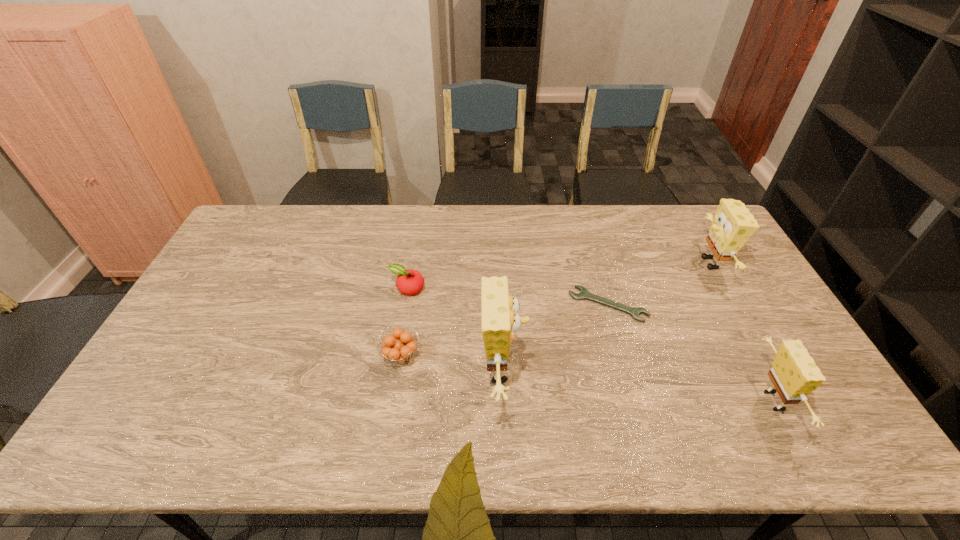
Please point out where to position a new sponge on the left to maintain spacing. Please provide its 2D coordinates. Your answer should be formatted as a tuple, i.e. [(x, y)], where the tuple contains the x and y coordinates of a point satisfying the conditions above.

[(259, 341)]